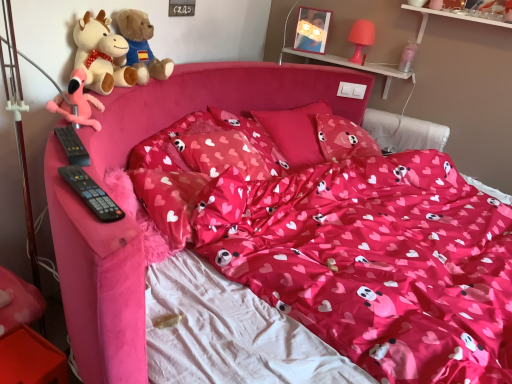
Identify the location of free location to the left of clear plastic bottle at upper right, the first toy when ordered from right to left. (385, 66).